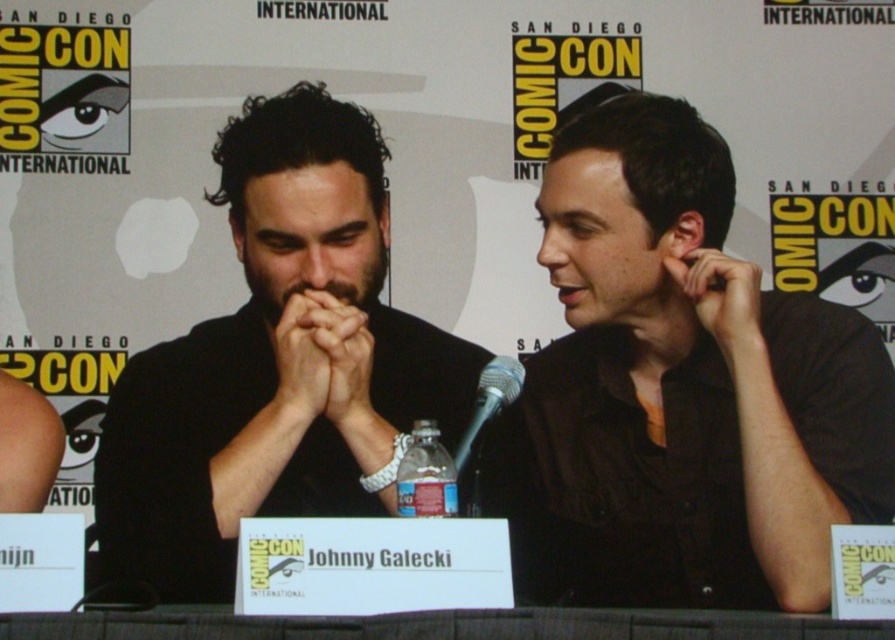
You are attending a panel at Comic Con and want to get a clear photo of the speaker wearing the black matte shirt at left. However, there is a silver metallic microphone at center in the way. Can you adjust your position to capture the speaker without the microphone blocking the view?

The black matte shirt at left is closer to the viewer than the silver metallic microphone at center, so moving your position slightly to the side might allow you to capture the speaker without the microphone blocking the view.

You are a photographer at Comic Con and need to capture a closeup shot of the black matte shirt at center and the silver metallic microphone at center. Which object is wider so that it can fill the frame better?

The black matte shirt at center is wider than the silver metallic microphone at center, so it can fill the frame better.